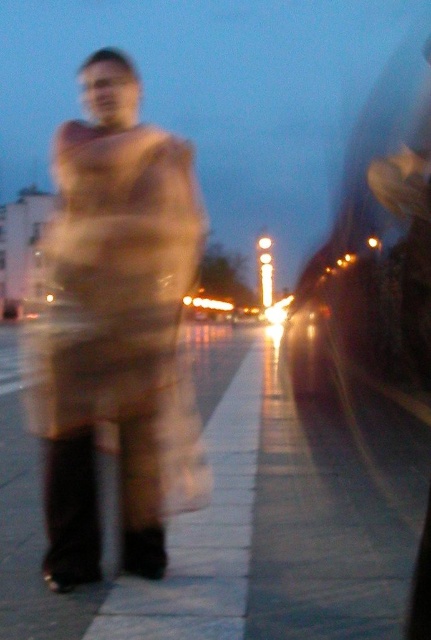
Question: Which point is farther to the camera?

Choices:
 (A) beige wool coat at center
 (B) smooth concrete sidewalk at center

Answer: (A)

Question: Does beige wool coat at center have a lesser width compared to smooth concrete sidewalk at center?

Choices:
 (A) no
 (B) yes

Answer: (A)

Question: Which point is farther from the camera taking this photo?

Choices:
 (A) (56, 186)
 (B) (12, 486)

Answer: (A)

Question: Can you confirm if beige wool coat at center is positioned below smooth concrete sidewalk at center?

Choices:
 (A) yes
 (B) no

Answer: (B)

Question: Is beige wool coat at center above smooth concrete sidewalk at center?

Choices:
 (A) yes
 (B) no

Answer: (A)